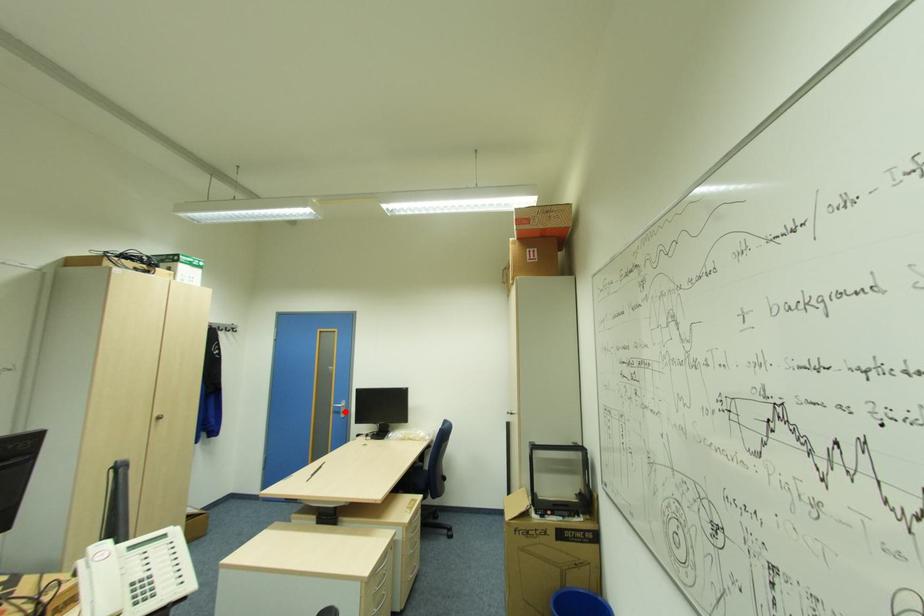
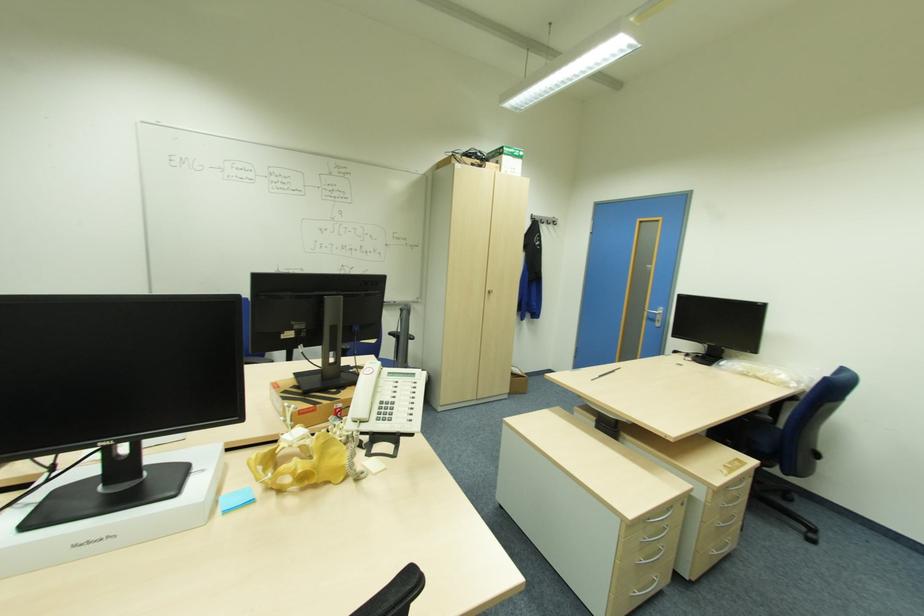
Question: A red point is marked in image1. In image2, is the corresponding 3D point closer to the camera or farther? Reply with the corresponding letter.

Choices:
 (A) The corresponding 3D point is closer.
 (B) The corresponding 3D point is farther.

Answer: (A)